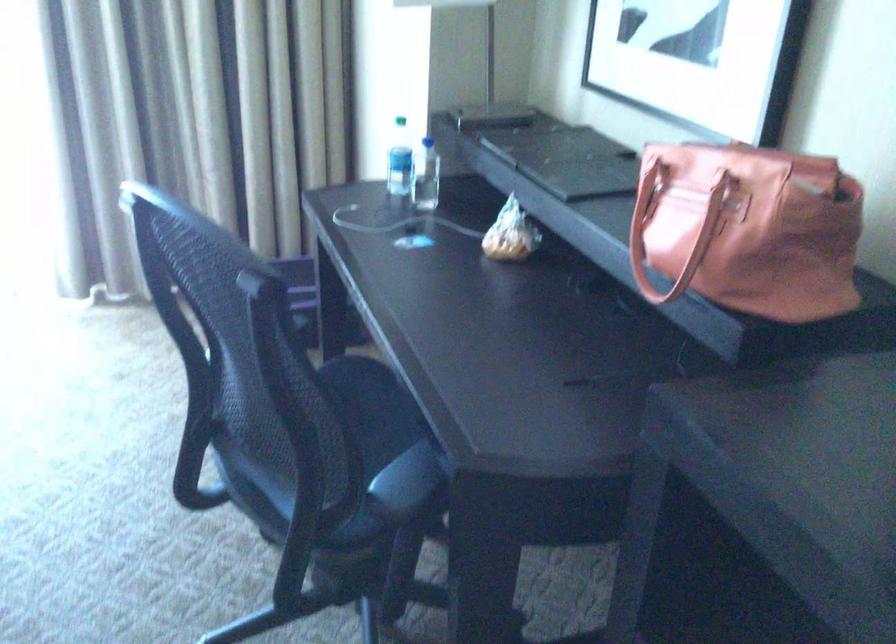
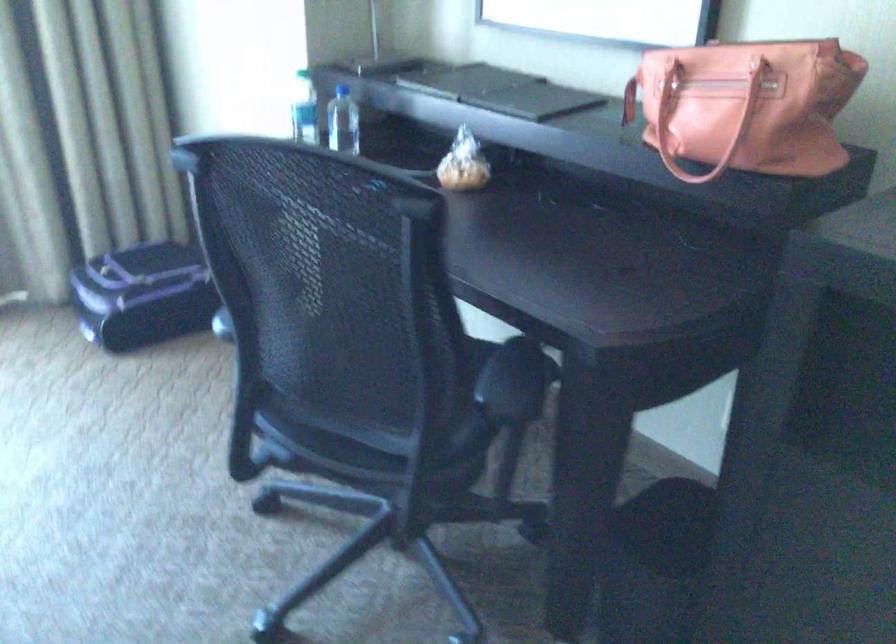
Where in the second image is the point corresponding to pixel 674 239 from the first image?

(704, 122)